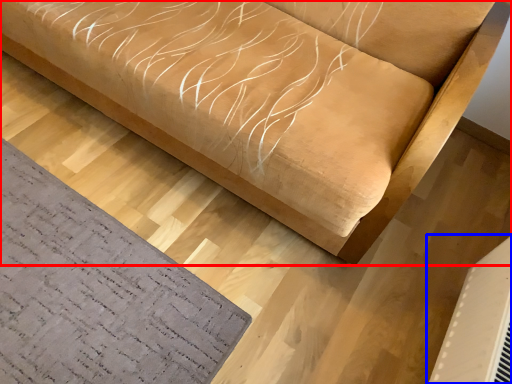
Question: Among these objects, which one is farthest to the camera, furniture (highlighted by a red box) or air conditioning (highlighted by a blue box)?

Choices:
 (A) furniture
 (B) air conditioning

Answer: (B)